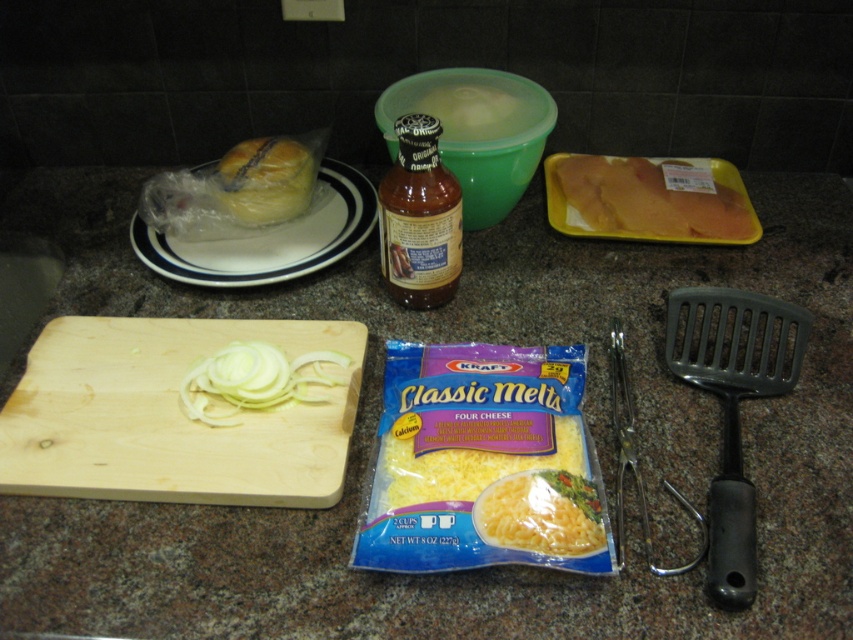
Question: Which object is farther from the camera taking this photo?

Choices:
 (A) white matte bowl at center
 (B) yellow bread at center
 (C) brown glass bottle at center

Answer: (A)

Question: Which of the following is the farthest from the observer?

Choices:
 (A) (428, 484)
 (B) (589, 483)
 (C) (415, 209)
 (D) (494, 120)

Answer: (D)

Question: Does yellow plastic tray at center appear over white matte bowl at center?

Choices:
 (A) no
 (B) yes

Answer: (A)

Question: In this image, where is light brown wooden cutting board at center left located relative to yellow bread at upper left?

Choices:
 (A) below
 (B) above

Answer: (A)

Question: Which of these objects is positioned farthest from the white creamy pasta at center?

Choices:
 (A) white shredded cheese at center
 (B) yellow bread at center
 (C) yellow bread at upper left

Answer: (C)

Question: Does light brown wooden cutting board at center left appear on the left side of yellow bread at upper left?

Choices:
 (A) yes
 (B) no

Answer: (A)